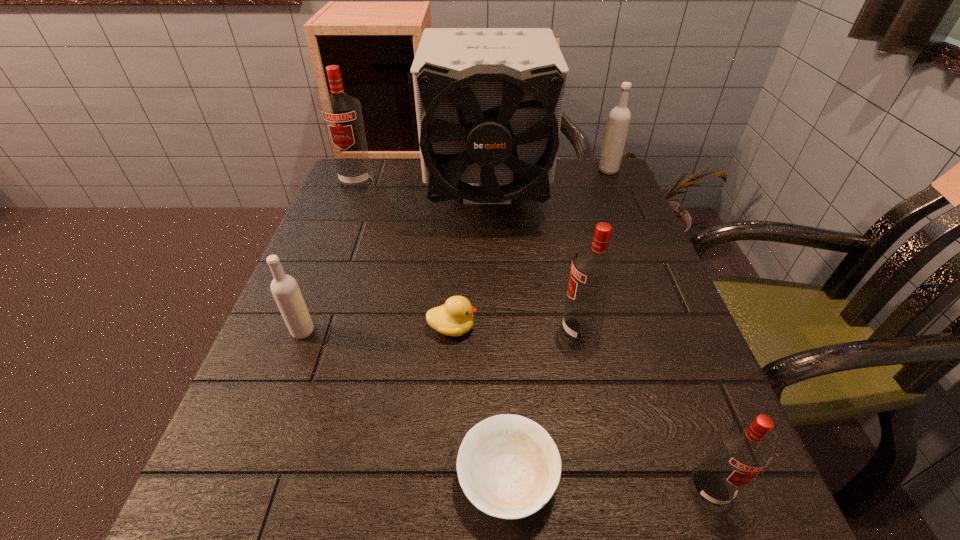
The width and height of the screenshot is (960, 540). What are the coordinates of `blank region between the nearest vodka and the seventh tallest object` in the screenshot? It's located at (581, 409).

At what (x,y) coordinates should I click in order to perform the action: click on empty space between the rightmost red vodka and the smaller white vodka. Please return your answer as a coordinate pair (x, y). The image size is (960, 540). Looking at the image, I should click on (506, 410).

The image size is (960, 540). I want to click on vacant space that's between the seventh tallest object and the shortest object, so click(x=480, y=404).

Locate an element on the screen. object that ranks as the second closest to the second farthest red vodka is located at coordinates (508, 466).

Identify which object is the second nearest to the gray fan. Please provide its 2D coordinates. Your answer should be formatted as a tuple, i.e. [(x, y)], where the tuple contains the x and y coordinates of a point satisfying the conditions above.

[(619, 118)]

The width and height of the screenshot is (960, 540). In order to click on the closest vodka to the right white vodka in this screenshot , I will do `click(594, 270)`.

This screenshot has width=960, height=540. What are the coordinates of `vodka that stands as the second closest to the smaller white vodka` in the screenshot? It's located at (594, 270).

The height and width of the screenshot is (540, 960). Find the location of `the second closest red vodka to the nearest red vodka`. the second closest red vodka to the nearest red vodka is located at coordinates (342, 114).

Locate which red vodka ranks in proximity to the tallest object. Please provide its 2D coordinates. Your answer should be formatted as a tuple, i.e. [(x, y)], where the tuple contains the x and y coordinates of a point satisfying the conditions above.

[(342, 114)]

Find the location of a particular element. The width and height of the screenshot is (960, 540). vacant region that satisfies the following two spatial constraints: 1. on the front side of the gray fan; 2. on the left side of the bowl is located at coordinates (493, 480).